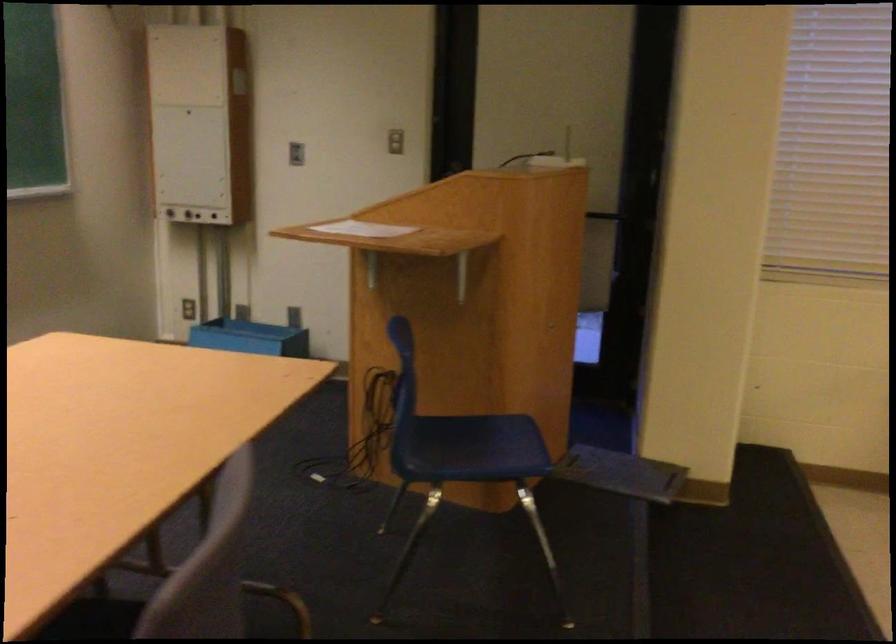
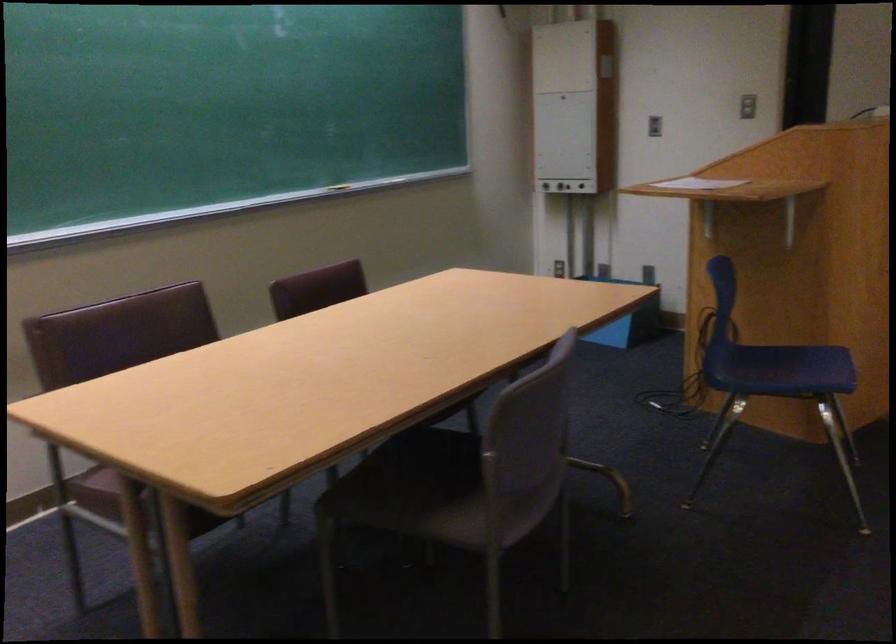
In the second image, find the point that corresponds to pixel 298 149 in the first image.

(653, 126)